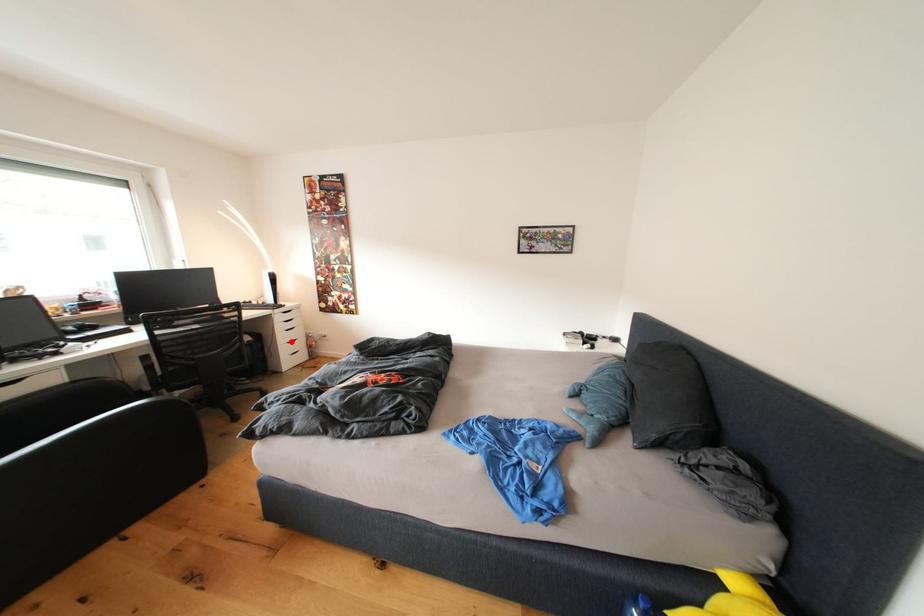
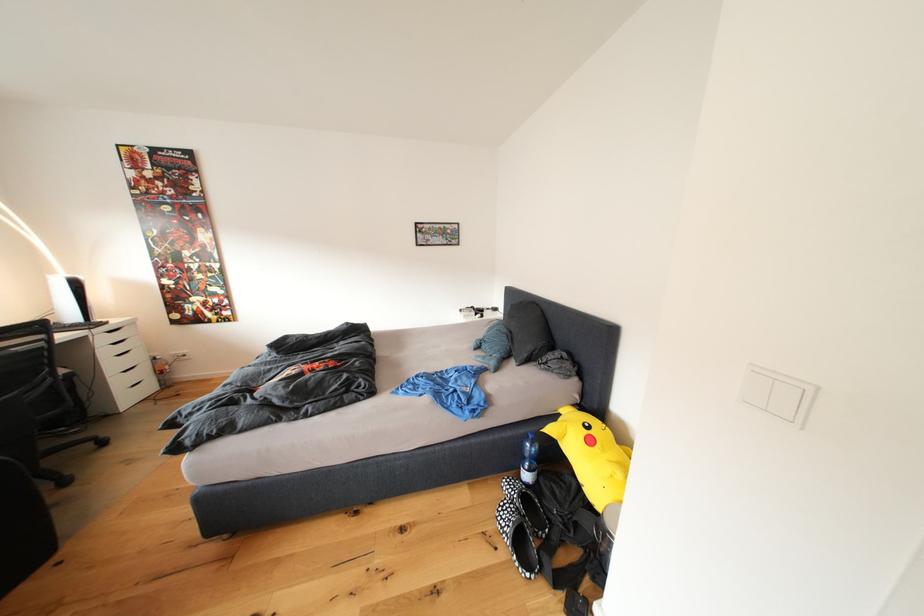
Locate, in the second image, the point that corresponds to the highlighted location in the first image.

(120, 370)